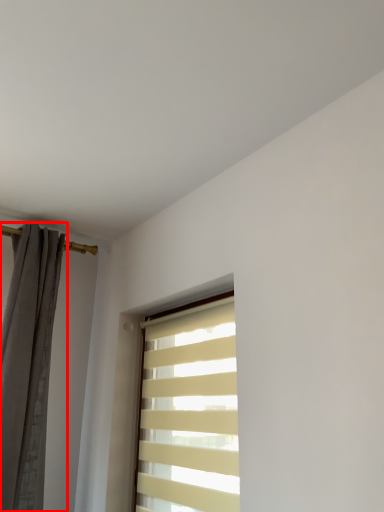
Question: From the image's perspective, considering the relative positions of curtain (annotated by the red box) and window in the image provided, where is curtain (annotated by the red box) located with respect to the staircase?

Choices:
 (A) above
 (B) below

Answer: (A)